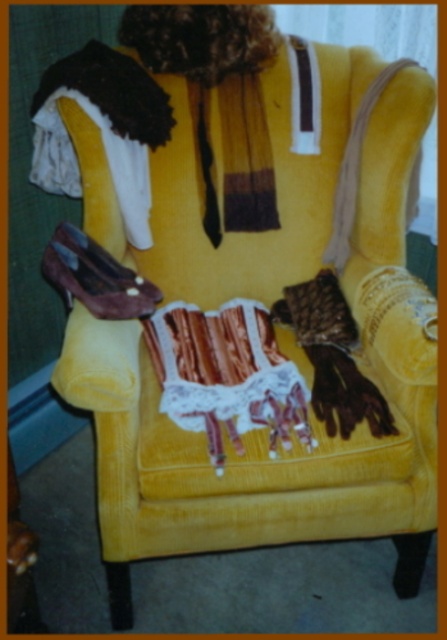
Does brown textured scarf at center have a greater width compared to shiny brown leather shoe at lower left?

In fact, brown textured scarf at center might be narrower than shiny brown leather shoe at lower left.

Looking at this image, can you confirm if brown textured scarf at center is thinner than shiny brown leather shoe at lower left?

Yes.

Is point (382, 433) more distant than point (112, 273)?

No.

Locate an element on the screen. The width and height of the screenshot is (447, 640). brown textured scarf at center is located at coordinates (333, 356).